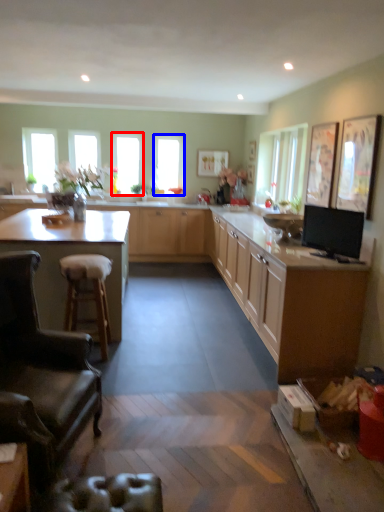
Question: Among these objects, which one is nearest to the camera, window (highlighted by a red box) or window (highlighted by a blue box)?

Choices:
 (A) window
 (B) window

Answer: (A)